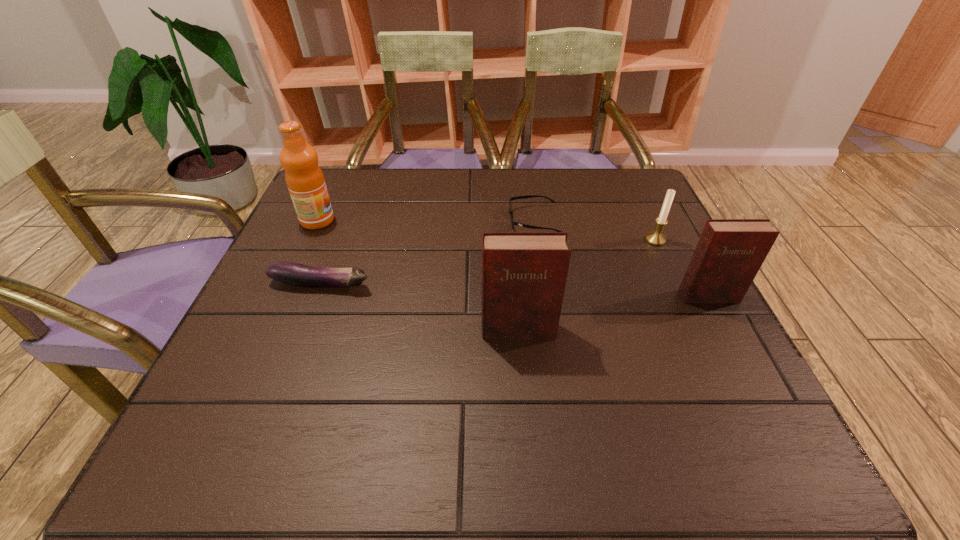
The height and width of the screenshot is (540, 960). I want to click on diary that is at the right edge, so click(729, 253).

Identify the location of candle holder present at the right edge. (656, 238).

The width and height of the screenshot is (960, 540). What are the coordinates of `object at the far left corner` in the screenshot? It's located at (304, 178).

Where is `vacant region at the far edge`? The height and width of the screenshot is (540, 960). vacant region at the far edge is located at coordinates (541, 173).

This screenshot has height=540, width=960. I want to click on vacant region at the near edge of the desktop, so click(584, 408).

Where is `blank area at the left edge`? The width and height of the screenshot is (960, 540). blank area at the left edge is located at coordinates (247, 318).

Locate an element on the screen. free region at the right edge of the desktop is located at coordinates (677, 308).

Where is `blank area at the far left corner`? The width and height of the screenshot is (960, 540). blank area at the far left corner is located at coordinates (349, 186).

This screenshot has height=540, width=960. In the image, there is a desktop. Identify the location of vacant region at the far right corner. (605, 192).

Image resolution: width=960 pixels, height=540 pixels. In the image, there is a desktop. Find the location of `vacant space at the near right corner`. vacant space at the near right corner is located at coordinates click(668, 396).